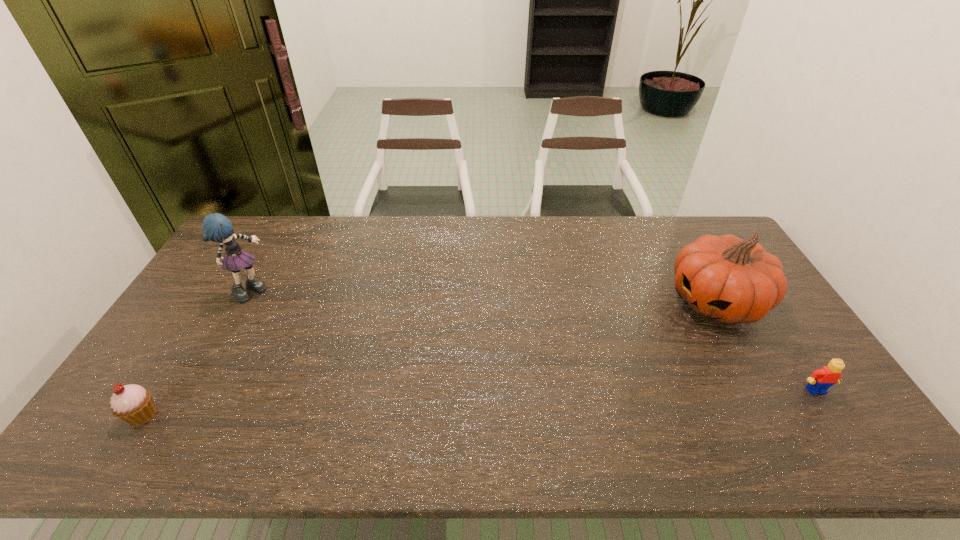
Identify the location of free space that is in between the third farthest object and the leftmost object. (479, 402).

I want to click on vacant area that lies between the Lego and the second tallest object, so click(x=765, y=346).

Identify the location of vacant area that lies between the leftmost object and the pumpkin. (429, 358).

The height and width of the screenshot is (540, 960). What are the coordinates of `vacant space that's between the cupcake and the second object from left to right` in the screenshot? It's located at (198, 353).

Where is `unoccupied area between the tallest object and the second nearest object`? The height and width of the screenshot is (540, 960). unoccupied area between the tallest object and the second nearest object is located at coordinates (534, 340).

Locate an element on the screen. the closest object relative to the Lego is located at coordinates (730, 280).

Identify which object is the third nearest to the tallest object. Please provide its 2D coordinates. Your answer should be formatted as a tuple, i.e. [(x, y)], where the tuple contains the x and y coordinates of a point satisfying the conditions above.

[(819, 382)]

Identify the location of free spot that satisfies the following two spatial constraints: 1. on the back side of the pumpkin; 2. on the right side of the nearest object. Image resolution: width=960 pixels, height=540 pixels. (214, 301).